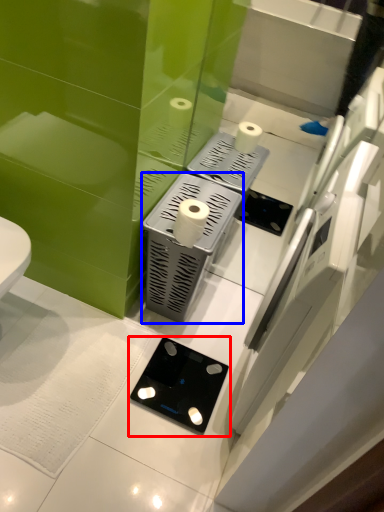
Question: Which object appears closest to the camera in this image, gadget (highlighted by a red box) or appliance (highlighted by a blue box)?

Choices:
 (A) gadget
 (B) appliance

Answer: (B)